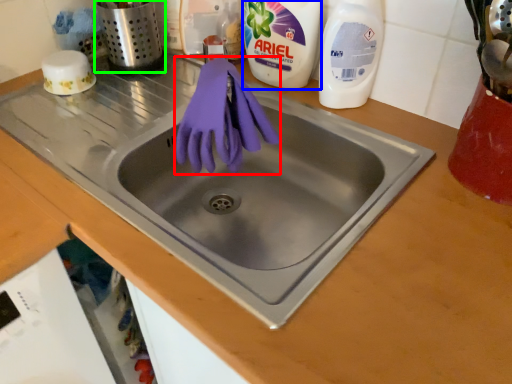
Question: Estimate the real-world distances between objects in this image. Which object is closer to glove (highlighted by a red box), cleaning product (highlighted by a blue box) or appliance (highlighted by a green box)?

Choices:
 (A) cleaning product
 (B) appliance

Answer: (A)